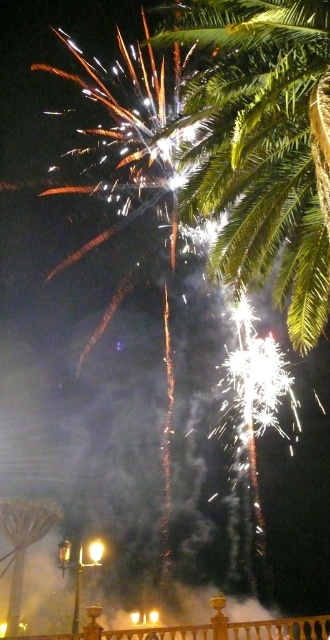
You are standing on a balcony and want to take a photo of the fireworks. The green leafy palm at upper right is blocking your view. Can you move to the left or right to avoid it?

The green leafy palm at upper right is located at coordinates point (264, 145). Since the palm is on the upper right, moving to the left would position you away from the obstruction, allowing a clearer view of the fireworks.

You are standing on a balcony looking at the fireworks. You notice the green leafy palm at upper right and the metallic streetlight at lower left. Which object is shorter?

The green leafy palm at upper right is shorter than the metallic streetlight at lower left.